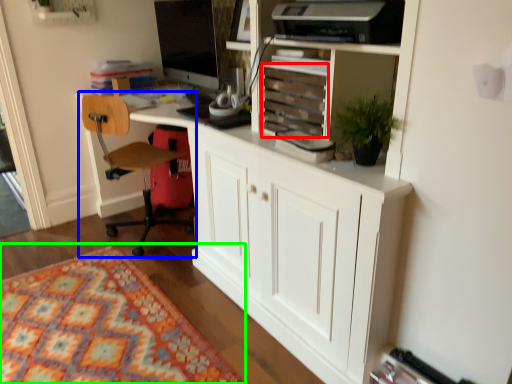
Question: Which object is positioned farthest from drawer (highlighted by a red box)? Select from chair (highlighted by a blue box) and mat (highlighted by a green box).

Choices:
 (A) chair
 (B) mat

Answer: (B)